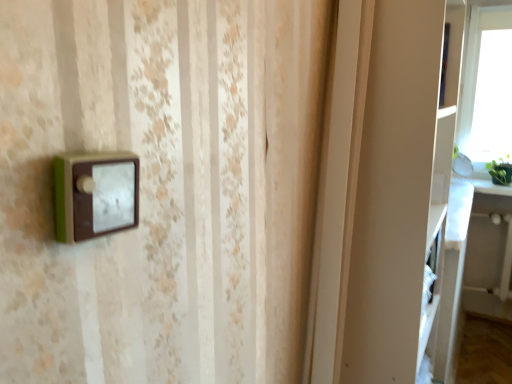
At what (x,y) coordinates should I click in order to perform the action: click on white glossy table at right. Please return your answer as a coordinate pair (x, y). Image resolution: width=512 pixels, height=384 pixels. Looking at the image, I should click on coord(489,242).

The width and height of the screenshot is (512, 384). Describe the element at coordinates (489, 242) in the screenshot. I see `white glossy table at right` at that location.

In order to face white glossy table at right, should I rotate leftwards or rightwards?

Rotate right and turn 29.553 degrees.

I want to click on white matte cabinet at right, so click(x=397, y=186).

What do you see at coordinates (397, 186) in the screenshot? I see `white matte cabinet at right` at bounding box center [397, 186].

This screenshot has height=384, width=512. In order to click on white glossy table at right in this screenshot , I will do `click(489, 242)`.

Between white glossy table at right and white matte cabinet at right, which one appears on the right side from the viewer's perspective?

white glossy table at right is more to the right.

Which is behind, white glossy table at right or white matte cabinet at right?

Positioned behind is white glossy table at right.

Which point is more forward, (510, 255) or (380, 119)?

The point (380, 119) is in front.

From the image's perspective, between white glossy table at right and white matte cabinet at right, who is located below?

From the image's view, white glossy table at right is below.

From a real-world perspective, between white glossy table at right and white matte cabinet at right, who is vertically lower?

white glossy table at right, from a real-world perspective.

Which object is wider, white glossy table at right or white matte cabinet at right?

white matte cabinet at right is wider.

Is white glossy table at right taller or shorter than white matte cabinet at right?

Considering their sizes, white glossy table at right has less height than white matte cabinet at right.

Looking at the image, does white glossy table at right seem bigger or smaller compared to white matte cabinet at right?

Considering their sizes, white glossy table at right takes up less space than white matte cabinet at right.

Is white glossy table at right located outside white matte cabinet at right?

white glossy table at right is positioned outside white matte cabinet at right.

Does white glossy table at right touch white matte cabinet at right?

No, white glossy table at right is not with white matte cabinet at right.

Could you tell me if white glossy table at right is turned towards white matte cabinet at right?

Yes, white glossy table at right is turned towards white matte cabinet at right.

Locate an element on the screen. This screenshot has width=512, height=384. table located underneath the white matte cabinet at right (from a real-world perspective) is located at coordinates (489, 242).

Considering the relative positions of white matte cabinet at right and white glossy table at right in the image provided, is white matte cabinet at right to the left or to the right of white glossy table at right?

white matte cabinet at right is positioned on white glossy table at right's left side.

Relative to white glossy table at right, is white matte cabinet at right in front or behind?

In the image, white matte cabinet at right appears in front of white glossy table at right.

Is point (443, 224) closer to viewer compared to point (480, 286)?

Yes, point (443, 224) is in front of point (480, 286).

From the image's perspective, is white matte cabinet at right beneath white glossy table at right?

Incorrect, from the image's perspective, white matte cabinet at right is higher than white glossy table at right.

From a real-world perspective, who is located lower, white matte cabinet at right or white glossy table at right?

In real-world perspective, white glossy table at right is lower.

Considering the relative sizes of white matte cabinet at right and white glossy table at right in the image provided, is white matte cabinet at right thinner than white glossy table at right?

Incorrect, the width of white matte cabinet at right is not less than that of white glossy table at right.

Is white matte cabinet at right taller or shorter than white glossy table at right?

In the image, white matte cabinet at right appears to be taller than white glossy table at right.

Considering the sizes of white matte cabinet at right and white glossy table at right in the image, is white matte cabinet at right bigger or smaller than white glossy table at right?

white matte cabinet at right is bigger than white glossy table at right.

Would you say white glossy table at right is part of white matte cabinet at right's contents?

No, white glossy table at right is not inside white matte cabinet at right.

Is white matte cabinet at right not close to white glossy table at right?

white matte cabinet at right is far away from white glossy table at right.

Is white glossy table at right at the back of white matte cabinet at right?

No, white glossy table at right is not at the back of white matte cabinet at right.

What's the angular difference between white matte cabinet at right and white glossy table at right's facing directions?

white matte cabinet at right and white glossy table at right are facing 90.1 degrees away from each other.

How far apart are white matte cabinet at right and white glossy table at right?

white matte cabinet at right and white glossy table at right are 1.51 meters apart.

Locate an element on the screen. The image size is (512, 384). cabinet above the white glossy table at right (from a real-world perspective) is located at coordinates (397, 186).

Locate an element on the screen. cabinet above the white glossy table at right (from a real-world perspective) is located at coordinates (397, 186).

The height and width of the screenshot is (384, 512). In order to click on cabinet located on the left of white glossy table at right in this screenshot , I will do `click(397, 186)`.